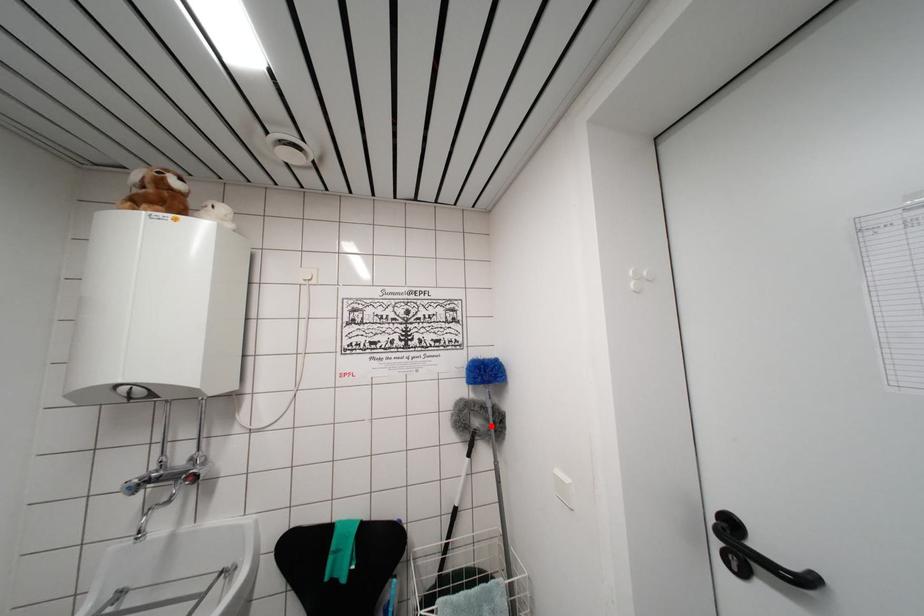
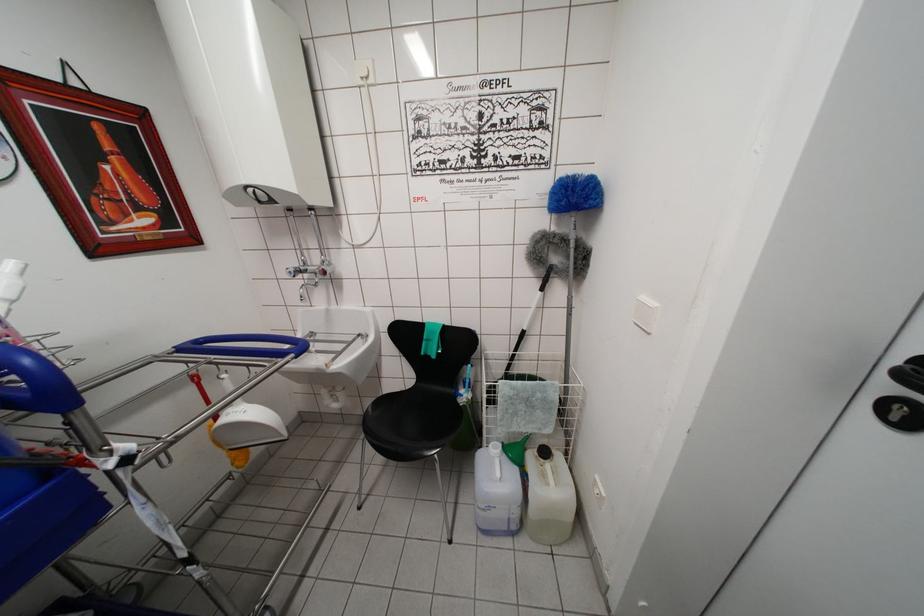
In the second image, find the point that corresponds to the highlighted location in the first image.

(572, 261)